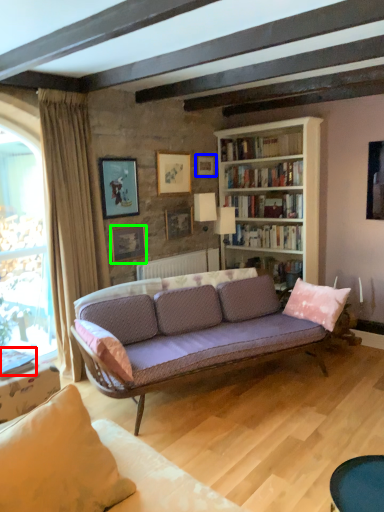
Question: Considering the real-world distances, which object is closest to book (highlighted by a red box)? picture frame (highlighted by a blue box) or picture frame (highlighted by a green box).

Choices:
 (A) picture frame
 (B) picture frame

Answer: (B)